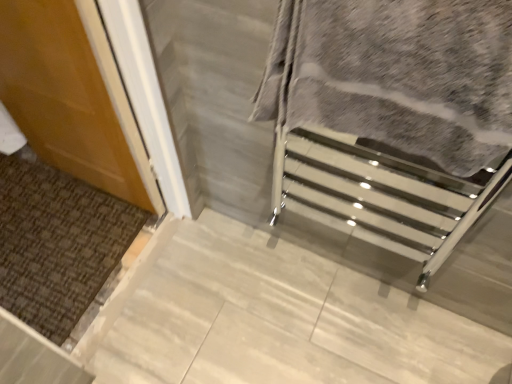
The height and width of the screenshot is (384, 512). What do you see at coordinates (399, 75) in the screenshot?
I see `gray textured towel at center` at bounding box center [399, 75].

I want to click on gray textured towel at center, so click(399, 75).

Identify the location of matte wood door at left. (72, 96).

The image size is (512, 384). What do you see at coordinates (72, 96) in the screenshot?
I see `matte wood door at left` at bounding box center [72, 96].

Image resolution: width=512 pixels, height=384 pixels. Find the location of `gray textured towel at center`. gray textured towel at center is located at coordinates (399, 75).

Is matte wood door at left to the left of gray textured towel at center from the viewer's perspective?

Indeed, matte wood door at left is positioned on the left side of gray textured towel at center.

Looking at this image, is matte wood door at left in front of or behind gray textured towel at center in the image?

matte wood door at left is behind gray textured towel at center.

Considering the points (86, 60) and (462, 15), which point is in front, point (86, 60) or point (462, 15)?

The point (462, 15) is in front.

Based on the photo, from the image's perspective, is matte wood door at left located above gray textured towel at center?

Yes, from the image's perspective, matte wood door at left is above gray textured towel at center.

From a real-world perspective, which is physically below, matte wood door at left or gray textured towel at center?

matte wood door at left, from a real-world perspective.

Which of these two, matte wood door at left or gray textured towel at center, is wider?

With larger width is gray textured towel at center.

From their relative heights in the image, would you say matte wood door at left is taller or shorter than gray textured towel at center?

matte wood door at left is taller than gray textured towel at center.

Does matte wood door at left have a smaller size compared to gray textured towel at center?

Incorrect, matte wood door at left is not smaller in size than gray textured towel at center.

Can gray textured towel at center be found inside matte wood door at left?

Definitely not — gray textured towel at center is not inside matte wood door at left.

Is matte wood door at left far away from gray textured towel at center?

No, there isn't a large distance between matte wood door at left and gray textured towel at center.

Is matte wood door at left facing away from gray textured towel at center?

No, matte wood door at left's orientation is not away from gray textured towel at center.

What's the angular difference between matte wood door at left and gray textured towel at center's facing directions?

2.09 degrees separate the facing orientations of matte wood door at left and gray textured towel at center.

Locate an element on the screen. This screenshot has height=384, width=512. door behind the gray textured towel at center is located at coordinates (72, 96).

Which object is positioned more to the left, gray textured towel at center or matte wood door at left?

From the viewer's perspective, matte wood door at left appears more on the left side.

Does gray textured towel at center lie in front of matte wood door at left?

Yes, gray textured towel at center is in front of matte wood door at left.

Does point (493, 52) lie in front of point (82, 49)?

Yes, it is.

From the image's perspective, is gray textured towel at center above or below matte wood door at left?

gray textured towel at center is below matte wood door at left.

From a real-world perspective, is gray textured towel at center positioned under matte wood door at left based on gravity?

No.

Which object is thinner, gray textured towel at center or matte wood door at left?

Thinner between the two is matte wood door at left.

Is gray textured towel at center shorter than matte wood door at left?

Yes, gray textured towel at center is shorter than matte wood door at left.

Considering the sizes of objects gray textured towel at center and matte wood door at left in the image provided, who is smaller, gray textured towel at center or matte wood door at left?

Smaller between the two is gray textured towel at center.

Would you say gray textured towel at center is outside matte wood door at left?

gray textured towel at center lies outside matte wood door at left's area.

Would you say gray textured towel at center is a long distance from matte wood door at left?

They are positioned close to each other.

Could you tell me if gray textured towel at center is turned towards matte wood door at left?

No, gray textured towel at center does not turn towards matte wood door at left.

What are the coordinates of `door that appears behind the gray textured towel at center` in the screenshot? It's located at (72, 96).

Image resolution: width=512 pixels, height=384 pixels. I want to click on blanket in front of the matte wood door at left, so click(399, 75).

The width and height of the screenshot is (512, 384). Find the location of `blanket above the matte wood door at left (from a real-world perspective)`. blanket above the matte wood door at left (from a real-world perspective) is located at coordinates (399, 75).